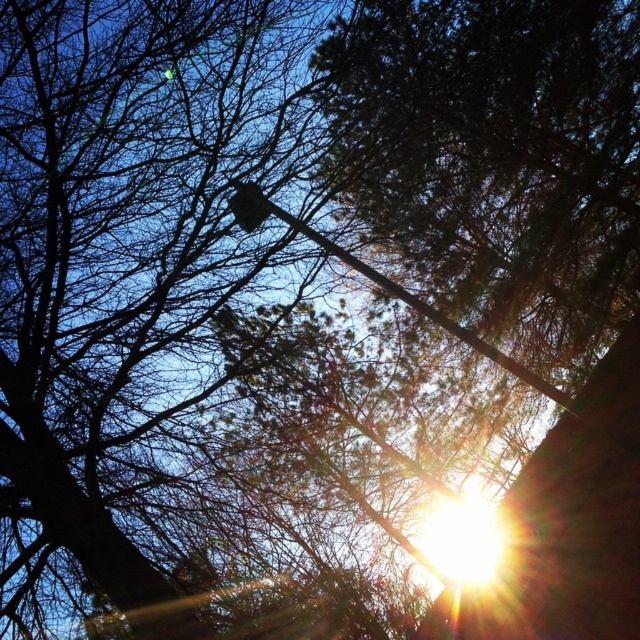
You are standing in the middle of the scene and want to place a small flag exactly at the point where the smooth metal pole at center is located. According to the coordinates provided, where should you place the flag?

The smooth metal pole at center is located at coordinates point [426,310], so you should place the flag at that exact point.

You are a photographer trying to capture the bright sun at upper center and the metallic gray traffic light at upper center in the same frame. Since both are at upper center, which one appears larger in the photo?

The bright sun at upper center appears larger than the metallic gray traffic light at upper center in the photo because it is bigger.